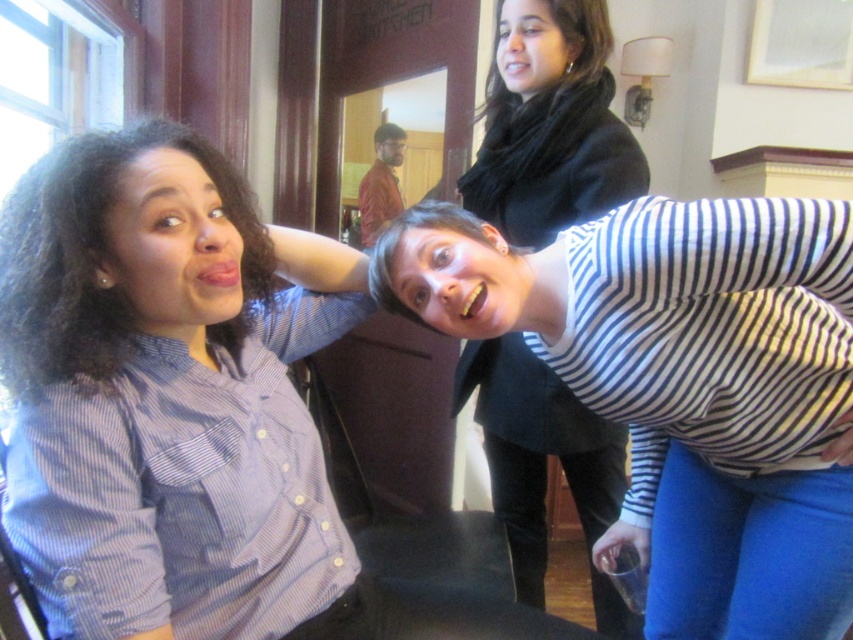
Question: Which object appears farthest from the camera in this image?

Choices:
 (A) red shirt at center
 (B) striped fabric shirt at upper right

Answer: (A)

Question: Is striped fabric shirt at upper right thinner than red shirt at center?

Choices:
 (A) yes
 (B) no

Answer: (B)

Question: Is white striped shirt at lower right below red shirt at center?

Choices:
 (A) no
 (B) yes

Answer: (B)

Question: Which object is positioned farthest from the dark curly hair at left?

Choices:
 (A) striped fabric shirt at upper right
 (B) blue striped shirt at upper center

Answer: (A)

Question: Considering the real-world distances, which object is closest to the black silky scarf at upper center?

Choices:
 (A) white striped shirt at lower right
 (B) blue striped shirt at upper center
 (C) striped fabric shirt at upper right
 (D) dark curly hair at left

Answer: (C)

Question: In this image, where is white striped shirt at lower right located relative to striped fabric shirt at upper right?

Choices:
 (A) right
 (B) left

Answer: (A)